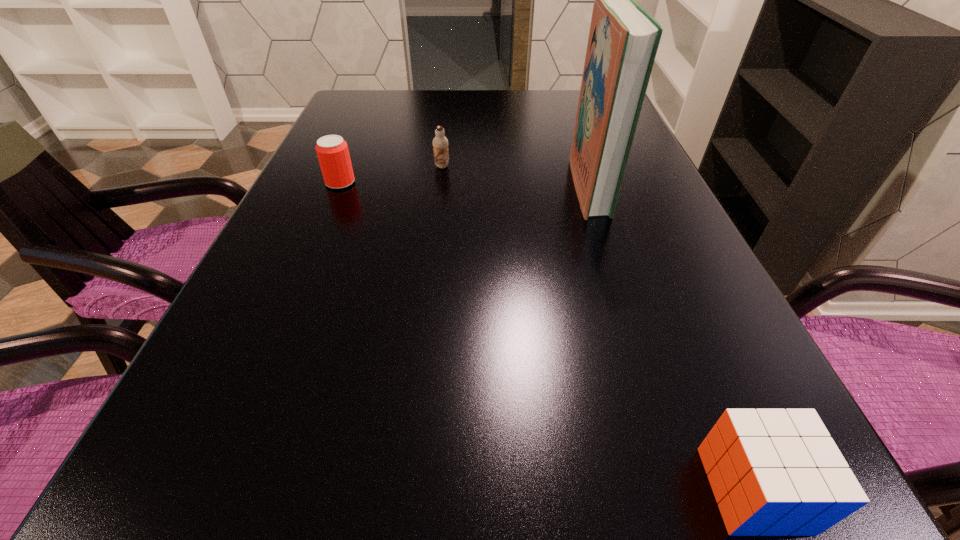
Where is `the closest object relative to the beer can`? The width and height of the screenshot is (960, 540). the closest object relative to the beer can is located at coordinates (440, 143).

At what (x,y) coordinates should I click in order to perform the action: click on vacant point that satisfies the following two spatial constraints: 1. on the back side of the beer can; 2. on the right side of the chocolate milk. Please return your answer as a coordinate pair (x, y). The image size is (960, 540). Looking at the image, I should click on (347, 166).

You are a GUI agent. You are given a task and a screenshot of the screen. Output one action in this format:
    pyautogui.click(x=<x>, y=<y>)
    Task: Click on the vacant space that satisfies the following two spatial constraints: 1. on the front side of the nearest object; 2. on the right side of the chocolate milk
    
    Given the screenshot: What is the action you would take?
    pyautogui.click(x=403, y=490)

You are a GUI agent. You are given a task and a screenshot of the screen. Output one action in this format:
    pyautogui.click(x=<x>, y=<y>)
    Task: Click on the free space that satisfies the following two spatial constraints: 1. on the cover of the nearest object; 2. on the right side of the tallest object
    
    Given the screenshot: What is the action you would take?
    pyautogui.click(x=687, y=490)

Identify the location of vacant space that satisfies the following two spatial constraints: 1. on the cover of the hardback book; 2. on the left side of the nearest object. This screenshot has width=960, height=540. (687, 490).